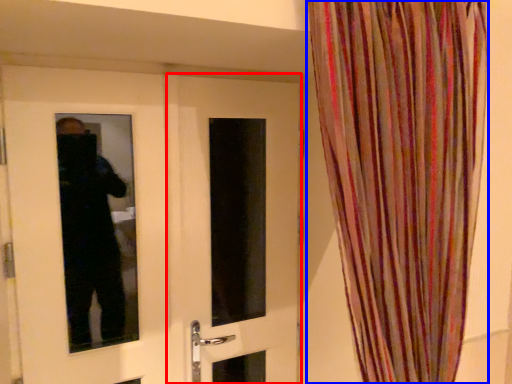
Question: Which object is further to the camera taking this photo, door (highlighted by a red box) or curtain (highlighted by a blue box)?

Choices:
 (A) door
 (B) curtain

Answer: (A)